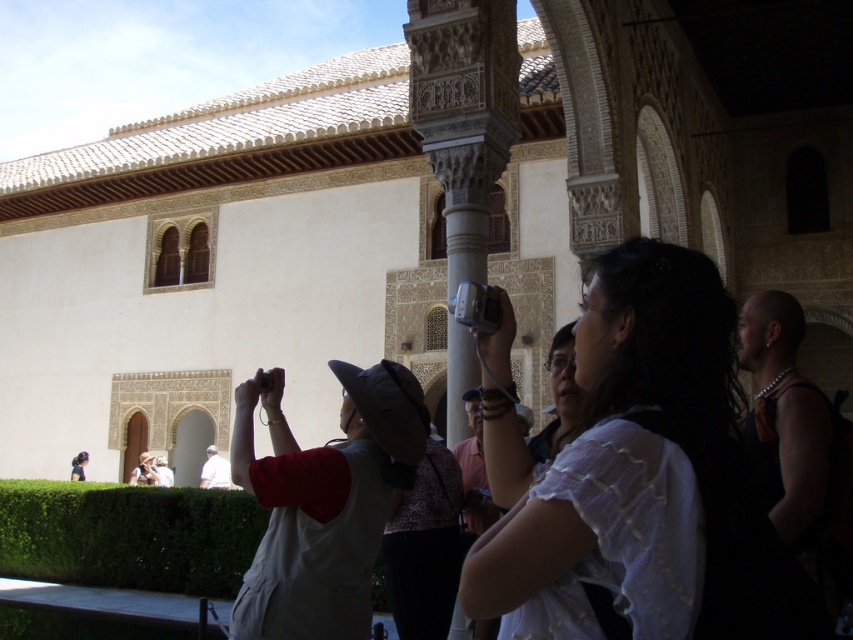
Question: Can you confirm if white lace shirt at center is thinner than black leather backpack at right?

Choices:
 (A) no
 (B) yes

Answer: (B)

Question: Does gray fabric hat at center have a smaller size compared to light brown straw hat at center?

Choices:
 (A) no
 (B) yes

Answer: (A)

Question: Which of the following is the closest to the observer?

Choices:
 (A) pos(155,480)
 (B) pos(604,531)
 (C) pos(257,481)

Answer: (B)

Question: Which point is farther to the camera?

Choices:
 (A) black leather backpack at right
 (B) gray fabric hat at center
 (C) matte white shirt at center

Answer: (C)

Question: Observing the image, what is the correct spatial positioning of gray fabric hat at center in reference to white cotton shirt at center?

Choices:
 (A) right
 (B) left

Answer: (B)

Question: Which point is closer to the camera?

Choices:
 (A) black leather backpack at right
 (B) white cotton shirt at center
 (C) light brown straw hat at center
 (D) gray fabric hat at center

Answer: (A)